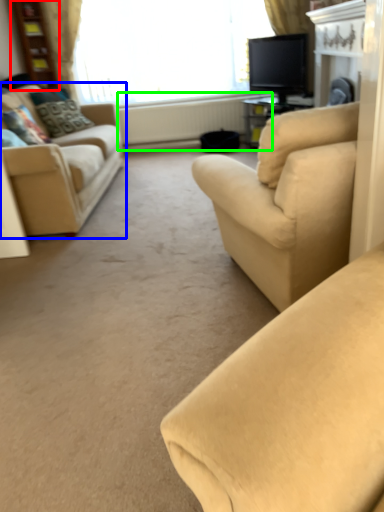
Question: Which is nearer to the bookshelf (highlighted by a red box)? studio couch (highlighted by a blue box) or radiator (highlighted by a green box).

Choices:
 (A) studio couch
 (B) radiator

Answer: (B)